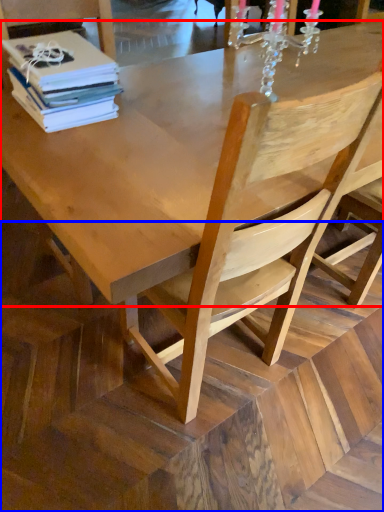
Question: Among these objects, which one is nearest to the camera, round table (highlighted by a red box) or stair (highlighted by a blue box)?

Choices:
 (A) round table
 (B) stair

Answer: (B)